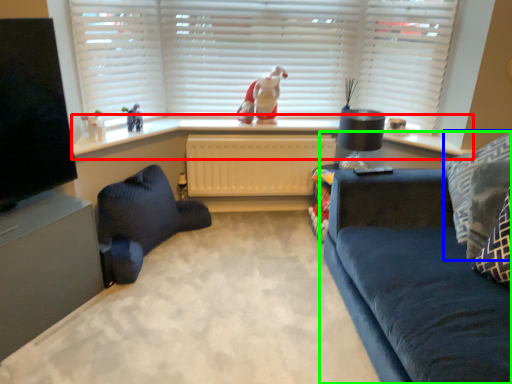
Question: Based on their relative distances, which object is nearer to window sill (highlighted by a red box)? Choose from pillow (highlighted by a blue box) and studio couch (highlighted by a green box).

Choices:
 (A) pillow
 (B) studio couch

Answer: (A)